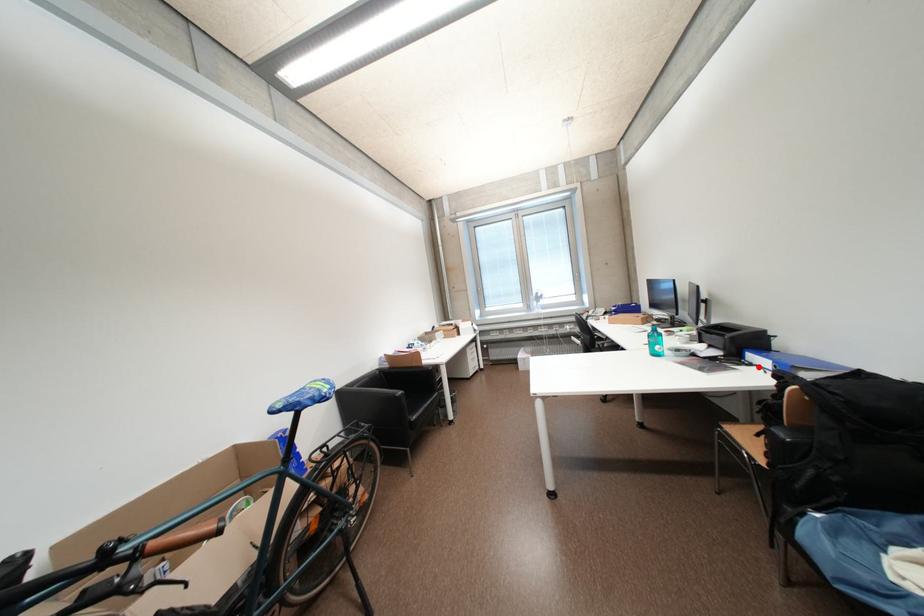
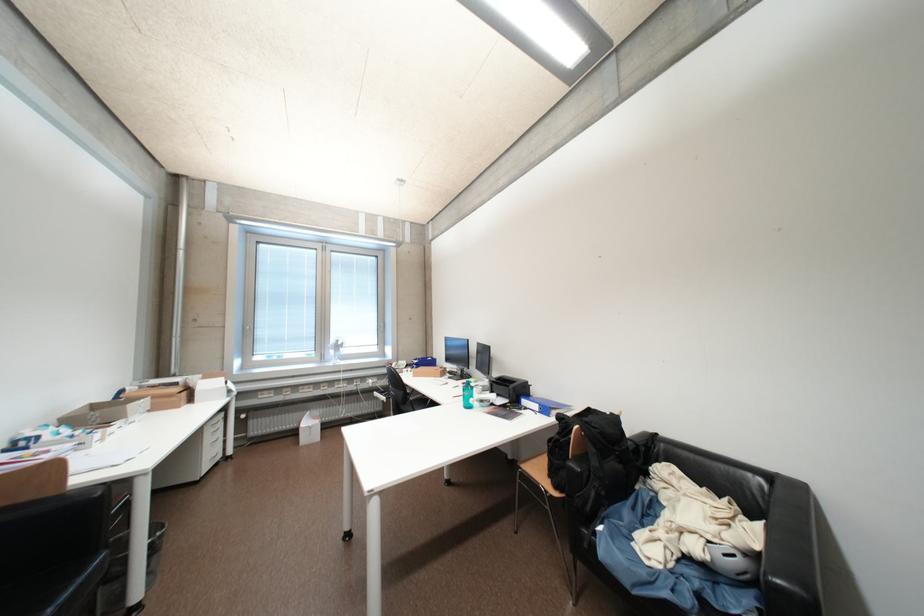
Question: A red point is marked in image1. In image2, is the corresponding 3D point closer to the camera or farther? Reply with the corresponding letter.

Choices:
 (A) The corresponding 3D point is closer.
 (B) The corresponding 3D point is farther.

Answer: (B)